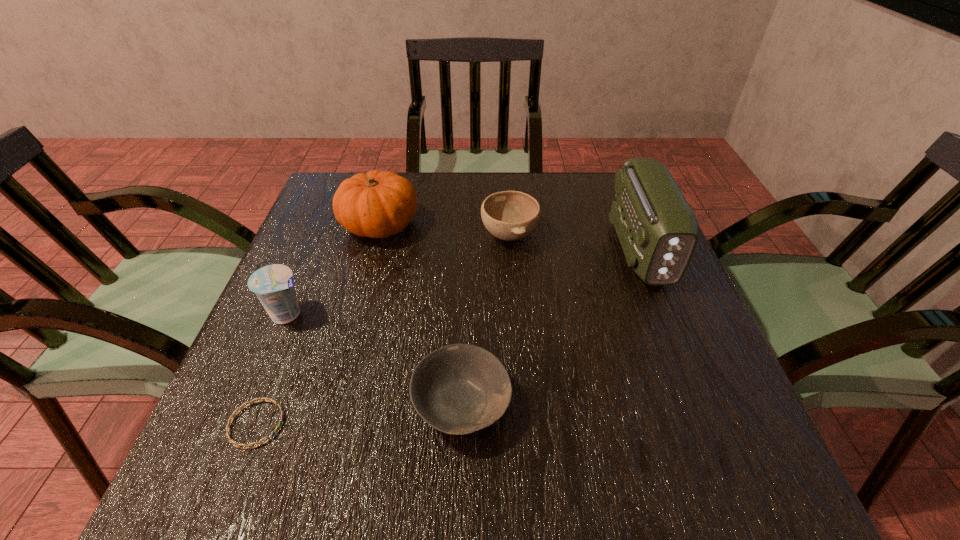
The height and width of the screenshot is (540, 960). I want to click on bracelet situated at the near edge, so click(232, 441).

The height and width of the screenshot is (540, 960). I want to click on pumpkin that is at the left edge, so click(377, 204).

This screenshot has height=540, width=960. What are the coordinates of `yogurt at the left edge` in the screenshot? It's located at (273, 284).

Where is `bracelet present at the left edge`? The height and width of the screenshot is (540, 960). bracelet present at the left edge is located at coordinates (232, 441).

Locate an element on the screen. object situated at the right edge is located at coordinates point(658,231).

Image resolution: width=960 pixels, height=540 pixels. Find the location of `object that is at the far left corner`. object that is at the far left corner is located at coordinates (377, 204).

Locate an element on the screen. This screenshot has width=960, height=540. object at the near left corner is located at coordinates (232, 441).

The height and width of the screenshot is (540, 960). Find the location of `object that is at the far right corner`. object that is at the far right corner is located at coordinates (658, 231).

I want to click on vacant area at the far edge, so click(557, 179).

In the image, there is a desktop. At what (x,y) coordinates should I click in order to perform the action: click on free space at the near edge. Please return your answer as a coordinate pair (x, y). Looking at the image, I should click on (348, 478).